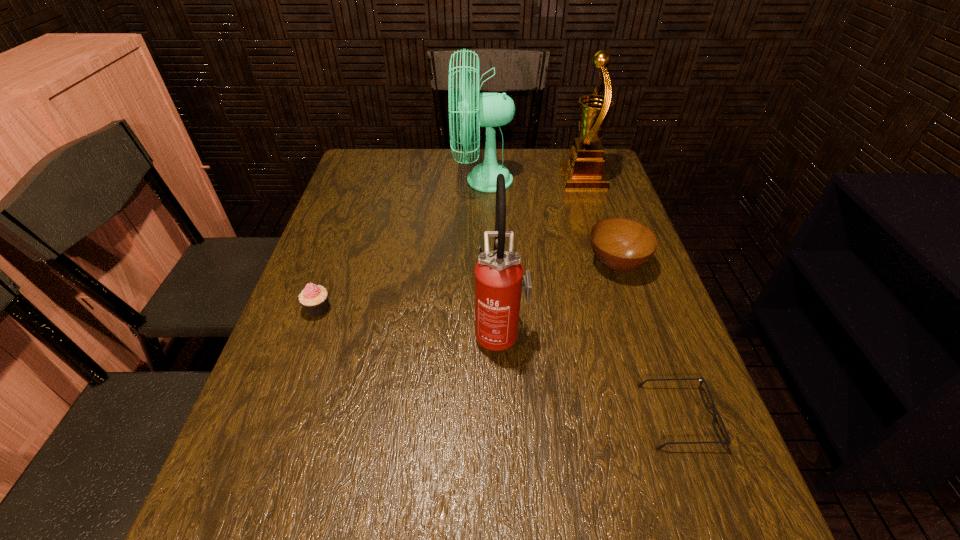
The image size is (960, 540). Find the location of `fan`. fan is located at coordinates coord(493,109).

Image resolution: width=960 pixels, height=540 pixels. I want to click on award, so click(x=584, y=170).

Locate an element on the screen. Image resolution: width=960 pixels, height=540 pixels. fire extinguisher is located at coordinates (499, 280).

Find the location of a particular element. the fourth nearest object is located at coordinates (620, 244).

Find the location of `the leftmost object`. the leftmost object is located at coordinates pyautogui.click(x=314, y=299).

Locate an element on the screen. spectacles is located at coordinates (701, 379).

Where is `the shortest object`? The width and height of the screenshot is (960, 540). the shortest object is located at coordinates (701, 379).

This screenshot has width=960, height=540. I want to click on vacant space situated 0.340m in front of the fan to blow air, so click(346, 180).

The image size is (960, 540). In order to click on vacant area located in front of the fan to blow air in this screenshot , I will do `click(387, 180)`.

Where is `free space located in front of the fan to blow air`? free space located in front of the fan to blow air is located at coordinates (424, 180).